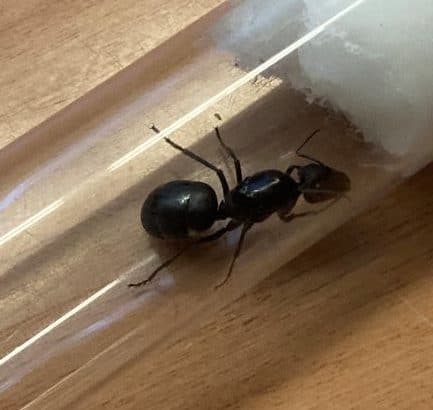
The width and height of the screenshot is (433, 410). I want to click on left front leg, so click(296, 168).